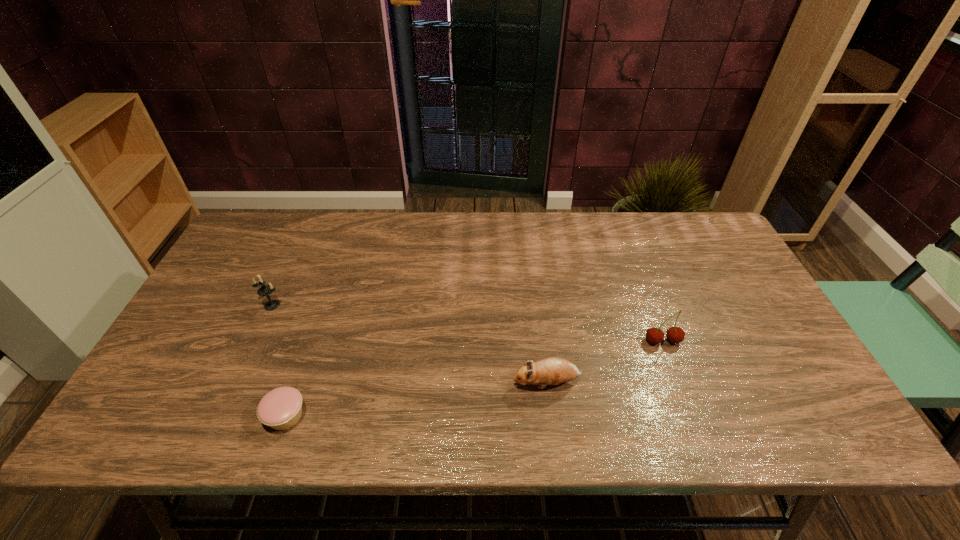
Locate an element on the screen. This screenshot has width=960, height=540. the rightmost object is located at coordinates (675, 335).

Locate an element on the screen. the third nearest object is located at coordinates (675, 335).

At what (x,y) coordinates should I click in order to perform the action: click on candle holder. Please return your answer as a coordinate pair (x, y). Looking at the image, I should click on (265, 290).

Where is `the leftmost object`? the leftmost object is located at coordinates (265, 290).

The image size is (960, 540). What are the coordinates of `hamster` in the screenshot? It's located at (550, 371).

I want to click on the second nearest object, so click(550, 371).

The width and height of the screenshot is (960, 540). I want to click on the nearest object, so click(x=281, y=408).

Locate an element on the screen. cupcake is located at coordinates pos(281,408).

Locate an element on the screen. Image resolution: width=960 pixels, height=540 pixels. vacant region located on the surface of the rightmost object is located at coordinates (677, 379).

I want to click on vacant space located on the right of the candle holder, so click(x=353, y=305).